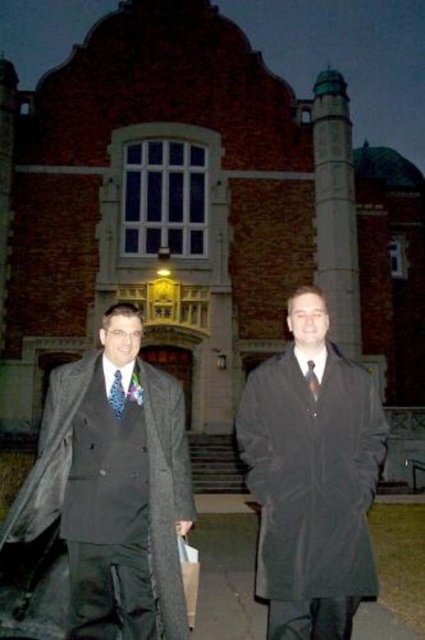
Which is behind, point (84, 362) or point (311, 371)?

Point (311, 371)

Where is `matte gray coat at left`? matte gray coat at left is located at coordinates (113, 488).

Is matte black coat at center to the right of matte blue tie at left from the viewer's perspective?

Correct, you'll find matte black coat at center to the right of matte blue tie at left.

Is matte black coat at center further to camera compared to matte blue tie at left?

That is False.

Is point (385, 428) more distant than point (119, 381)?

That is False.

Where is `matte black coat at center`? The height and width of the screenshot is (640, 425). matte black coat at center is located at coordinates (311, 477).

Is matte gray coat at left shorter than matte black coat at center?

Indeed, matte gray coat at left has a lesser height compared to matte black coat at center.

Is matte gray coat at left bigger than matte black coat at center?

No, matte gray coat at left is not bigger than matte black coat at center.

Measure the distance between matte gray coat at left and camera.

They are 34.47 meters apart.

At what (x,y) coordinates should I click in order to perform the action: click on matte gray coat at left. Please return your answer as a coordinate pair (x, y). Image resolution: width=425 pixels, height=640 pixels. Looking at the image, I should click on (113, 488).